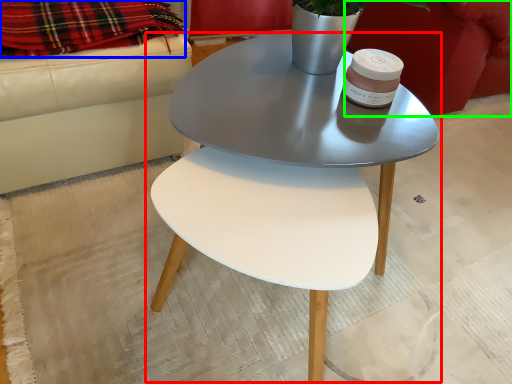
Question: Estimate the real-world distances between objects in this image. Which object is closer to coffee table (highlighted by a red box), blanket (highlighted by a blue box) or armchair (highlighted by a green box)?

Choices:
 (A) blanket
 (B) armchair

Answer: (A)